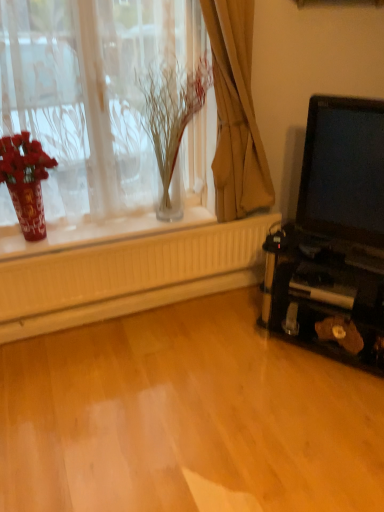
Question: From the image's perspective, is translucent glass vase at upper left above or below translucent glass vase at upper center?

Choices:
 (A) below
 (B) above

Answer: (B)

Question: In the image, is translucent glass vase at upper left on the left side or the right side of translucent glass vase at upper center?

Choices:
 (A) right
 (B) left

Answer: (B)

Question: Considering the real-world distances, which object is closest to the translucent glass vase at upper left?

Choices:
 (A) matte black laptop at right
 (B) shiny red vase at left
 (C) brown fabric curtain at upper center
 (D) translucent glass vase at upper center

Answer: (D)

Question: Which of these objects is positioned farthest from the matte black laptop at right?

Choices:
 (A) translucent glass vase at upper left
 (B) brown fabric curtain at upper center
 (C) shiny red vase at left
 (D) translucent glass vase at upper center

Answer: (C)